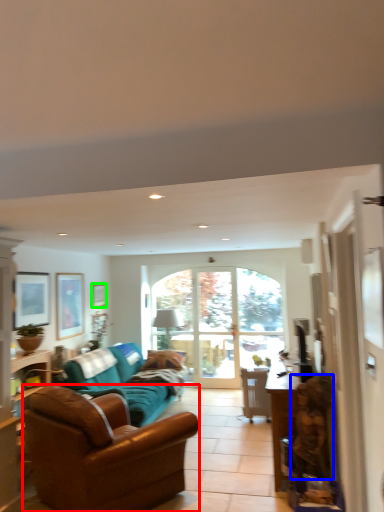
Question: Which object is the farthest from studio couch (highlighted by a red box)? Choose among these: person (highlighted by a blue box) or picture frame (highlighted by a green box).

Choices:
 (A) person
 (B) picture frame

Answer: (B)